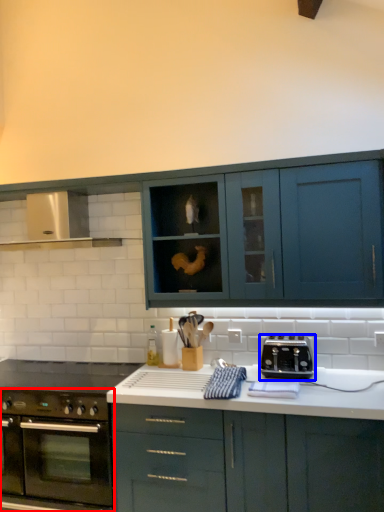
Question: Which of the following is the farthest to the observer, oven (highlighted by a red box) or toaster (highlighted by a blue box)?

Choices:
 (A) oven
 (B) toaster

Answer: (B)